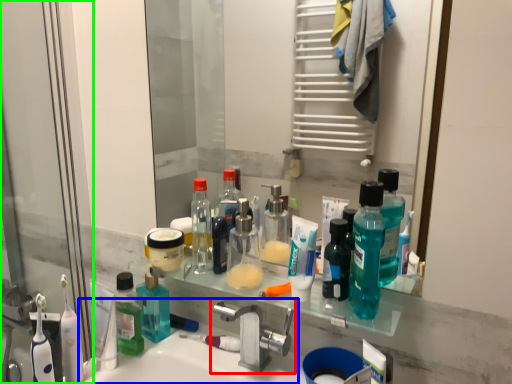
Question: Which is nearer to the tap (highlighted by a red box)? sink (highlighted by a blue box) or screen door (highlighted by a green box).

Choices:
 (A) sink
 (B) screen door

Answer: (A)